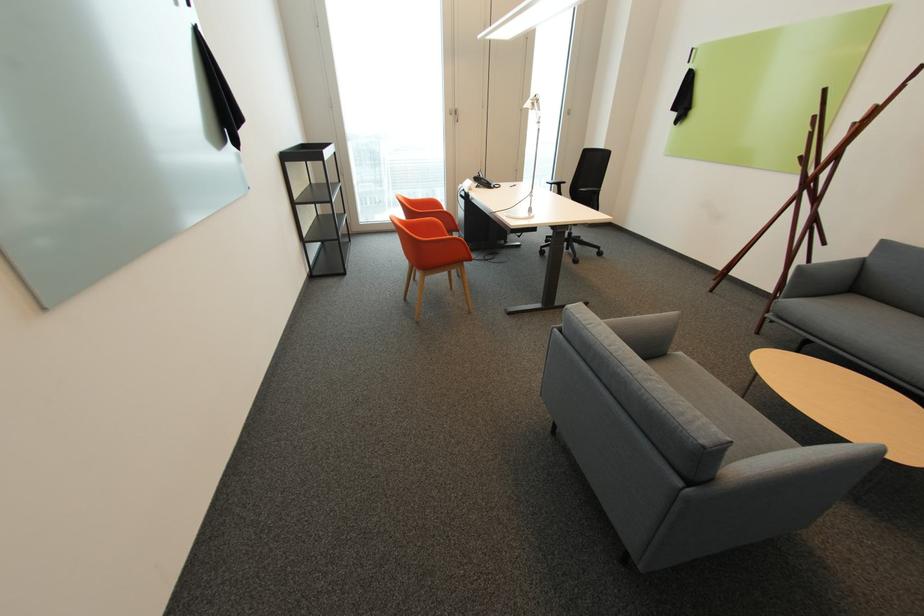
The width and height of the screenshot is (924, 616). What do you see at coordinates (555, 184) in the screenshot?
I see `a black chair armrest` at bounding box center [555, 184].